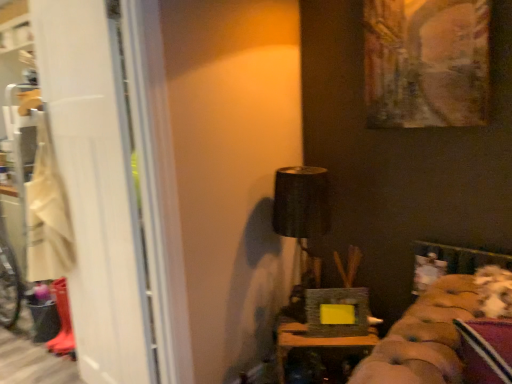
Question: From a real-world perspective, relative to oil painting at upper right, which ranks as the 2th picture frame in left-to-right order, is white matte screen door at left vertically above or below?

Choices:
 (A) below
 (B) above

Answer: (A)

Question: Considering their positions, is white matte screen door at left located in front of or behind oil painting at upper right, arranged as the second picture frame when ordered from the bottom?

Choices:
 (A) behind
 (B) front

Answer: (B)

Question: Which is nearer to the matte black picture frame at center, which is the first picture frame in left-to-right order?

Choices:
 (A) beige fabric laundry at left
 (B) oil painting at upper right, which ranks as the 2th picture frame in left-to-right order
 (C) black fabric lampshade at upper center
 (D) white matte screen door at left
 (E) wooden textured box at center

Answer: (E)

Question: Considering the real-world distances, which object is closest to the black fabric lampshade at upper center?

Choices:
 (A) beige fabric laundry at left
 (B) wooden textured box at center
 (C) white matte screen door at left
 (D) matte black picture frame at center, acting as the second picture frame starting from the top
 (E) oil painting at upper right, the 1th picture frame in the top-to-bottom sequence

Answer: (D)